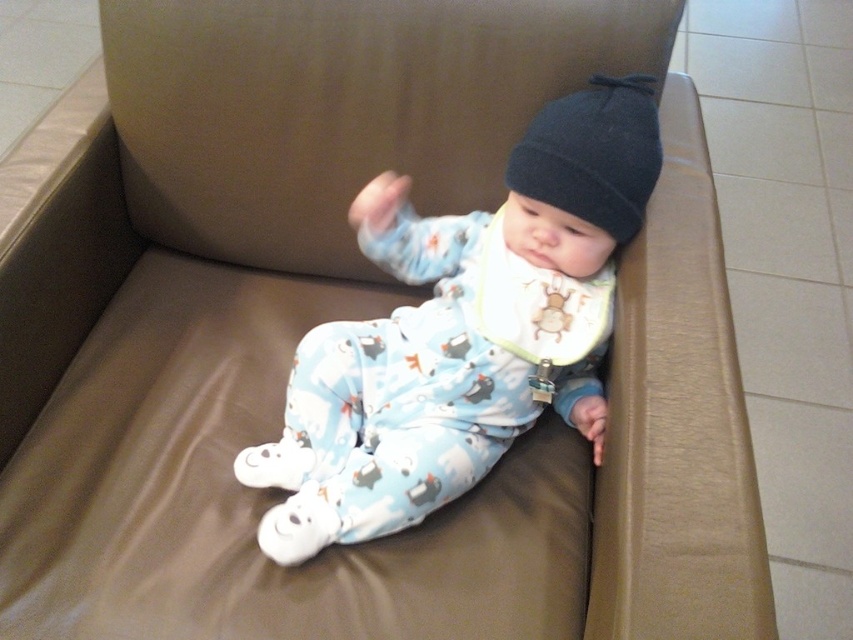
Question: Is blue cotton onesie at center behind black knit beanie at upper center?

Choices:
 (A) yes
 (B) no

Answer: (B)

Question: Does blue cotton onesie at center appear under black knit beanie at upper center?

Choices:
 (A) no
 (B) yes

Answer: (B)

Question: Which point is farther to the camera?

Choices:
 (A) (590, 88)
 (B) (497, 268)

Answer: (B)

Question: Among these points, which one is farthest from the camera?

Choices:
 (A) (402, 396)
 (B) (625, 132)

Answer: (A)

Question: Among these objects, which one is farthest from the camera?

Choices:
 (A) black knit beanie at upper center
 (B) blue cotton onesie at center

Answer: (A)

Question: Is blue cotton onesie at center behind black knit beanie at upper center?

Choices:
 (A) yes
 (B) no

Answer: (B)